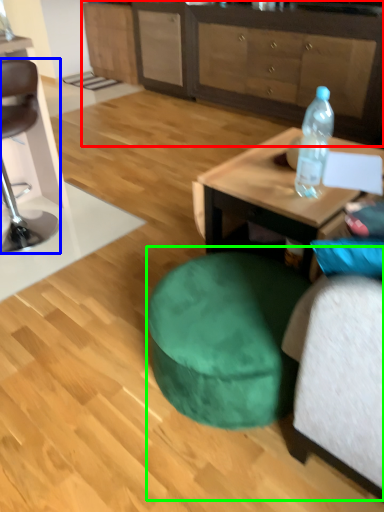
Question: Considering the real-world distances, which object is closest to cabinetry (highlighted by a red box)? chair (highlighted by a blue box) or bean bag chair (highlighted by a green box).

Choices:
 (A) chair
 (B) bean bag chair

Answer: (A)